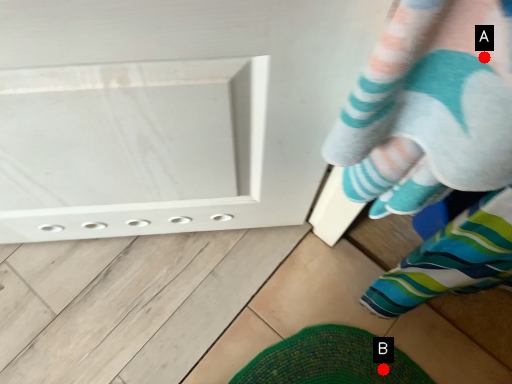
Question: Two points are circled on the image, labeled by A and B beside each circle. Which point is farther from the camera taking this photo?

Choices:
 (A) A is further
 (B) B is further

Answer: (B)